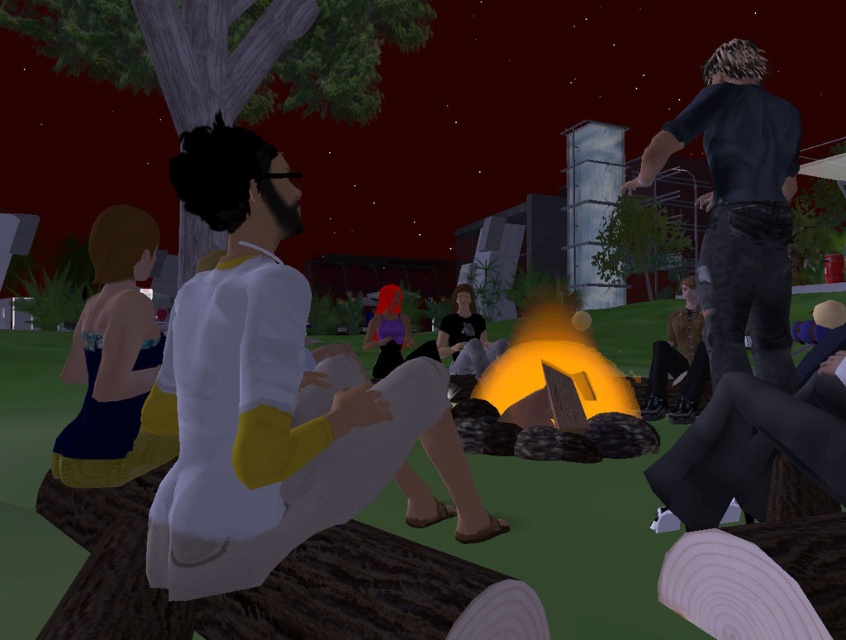
You are a photographer at the campsite and want to capture a photo of the shiny purple hair at center and the matte black shirt at center. From the photographer position, which object is on the left side?

The shiny purple hair at center is on the left side of the matte black shirt at center.

You are standing in the night scene and want to find the blue fabric dress at left. Which direction should you look relative to the smooth gray bark at upper left?

The smooth gray bark at upper left is above the blue fabric dress at left, so you should look downward from the smooth gray bark at upper left to find the blue fabric dress at left.

You are a photographer at the campsite. You want to take a photo of the blue fabric dress at left and the smooth gray bark at upper left. Which object should be placed closer to the camera to ensure both are in focus?

The smooth gray bark at upper left should be placed closer to the camera because the blue fabric dress at left is behind the smooth gray bark at upper left, so moving the bark forward will help both objects be in focus.